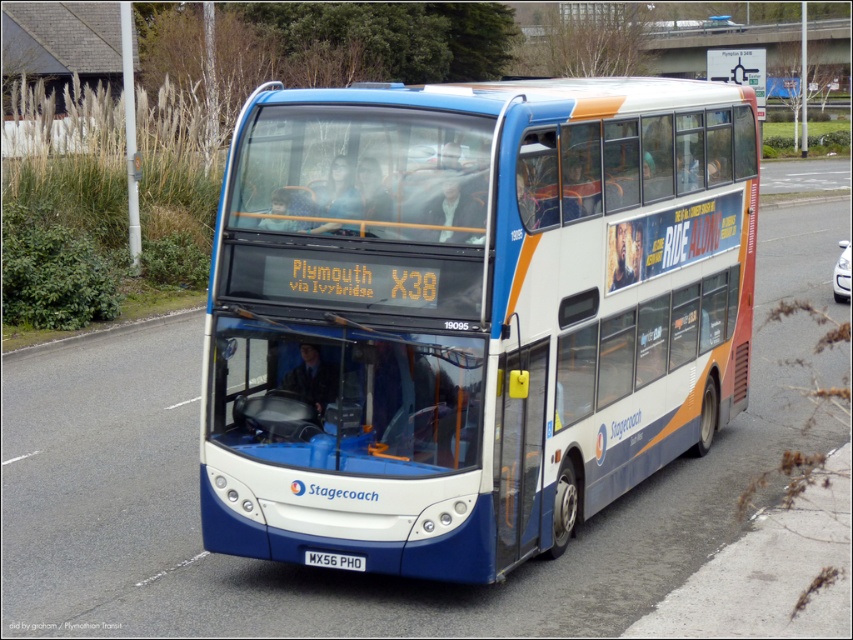
The image size is (853, 640). Find the location of `white glossy bus at center`. white glossy bus at center is located at coordinates point(469,312).

Is white glossy bus at center further to the viewer compared to white metallic license plate at bottom?

No, white glossy bus at center is closer to the viewer.

Which is in front, point (672, 179) or point (338, 566)?

Positioned in front is point (338, 566).

Image resolution: width=853 pixels, height=640 pixels. I want to click on white glossy bus at center, so click(469, 312).